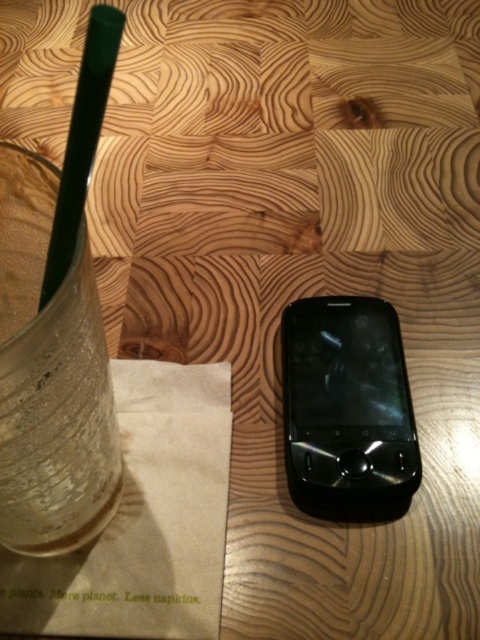
You are a delivery robot with a 12 inch wide package. You need to place it on the table between the black glossy smartphone at center and the green plastic straw at upper left. Is there enough space?

The distance between the black glossy smartphone at center and the green plastic straw at upper left is 10.47 inches. Since the package is 12 inches wide, it is wider than the available space, so it won not fit.

You are setting up a small table for a meeting. You have a clear glass at left and a black glossy smartphone at center. Which object takes up more horizontal space on the table?

The clear glass at left is wider than the black glossy smartphone at center, so it takes up more horizontal space on the table.